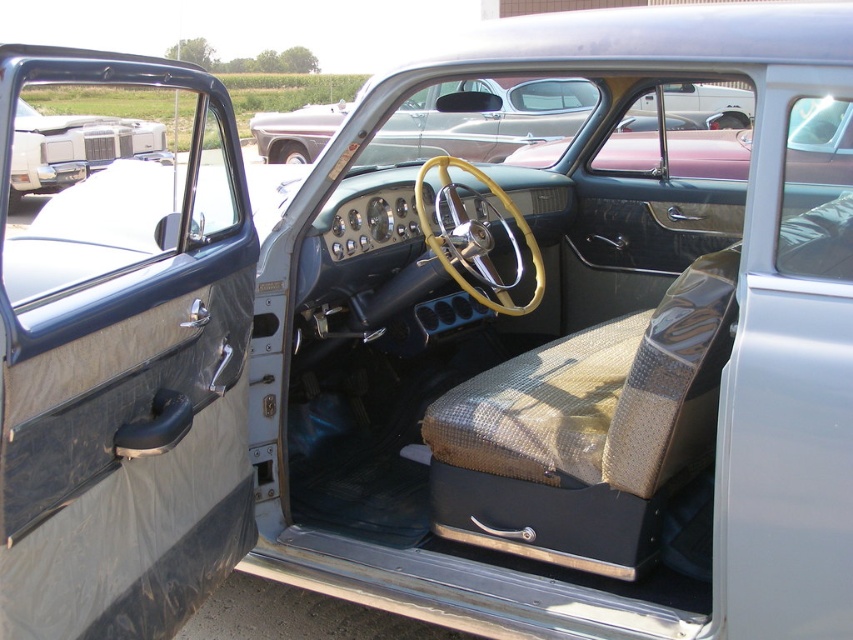
Question: Which object appears closest to the camera in this image?

Choices:
 (A) matte gray door at left
 (B) metallic red pickup truck at center

Answer: (A)

Question: Which point is closer to the camera?

Choices:
 (A) (540, 147)
 (B) (204, 136)

Answer: (A)

Question: From the image, what is the correct spatial relationship of matte gray door at left in relation to metallic red pickup truck at center?

Choices:
 (A) right
 (B) left

Answer: (B)

Question: Is the position of matte gray door at left less distant than that of metallic red pickup truck at center?

Choices:
 (A) no
 (B) yes

Answer: (B)

Question: Is matte gray door at left above metallic red pickup truck at center?

Choices:
 (A) yes
 (B) no

Answer: (A)